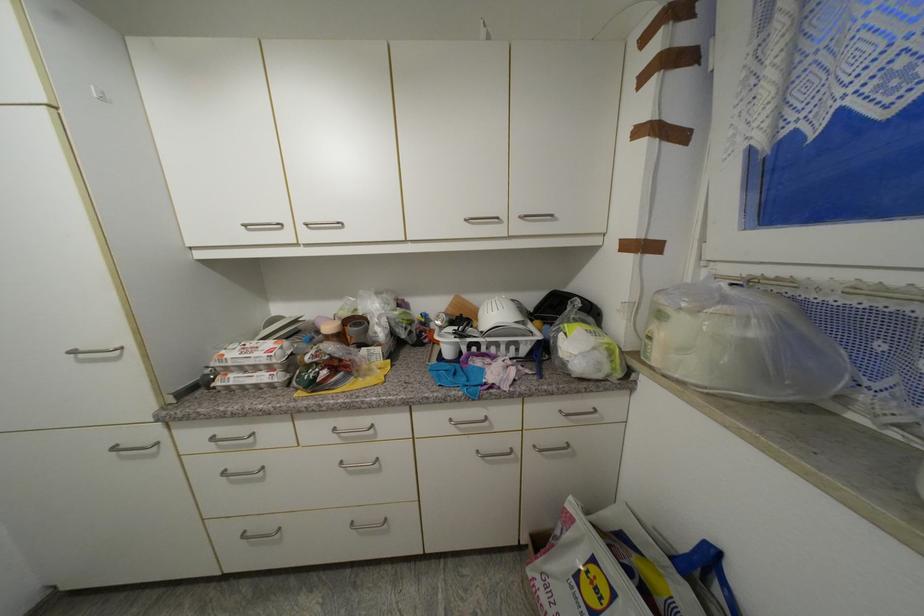
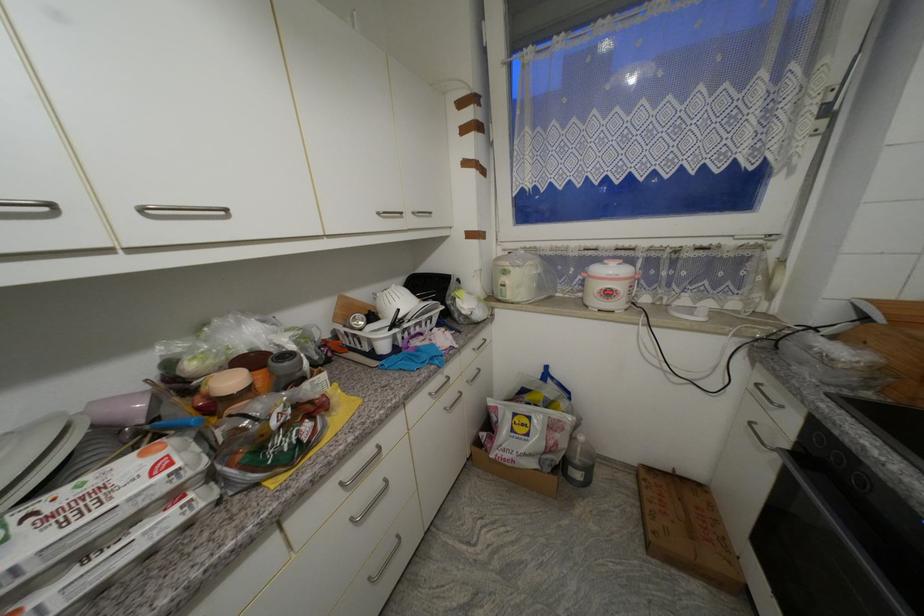
In the second image, find the point that corresponds to point (526, 217) in the first image.

(419, 215)